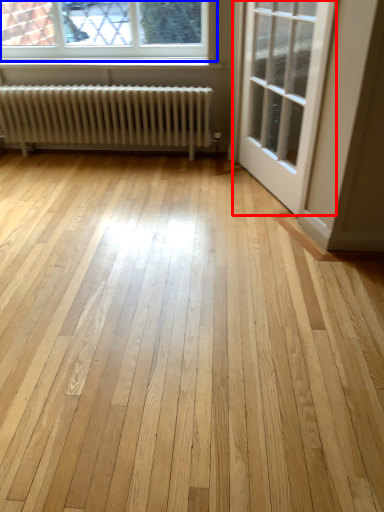
Question: Among these objects, which one is farthest to the camera, door (highlighted by a red box) or window (highlighted by a blue box)?

Choices:
 (A) door
 (B) window

Answer: (B)